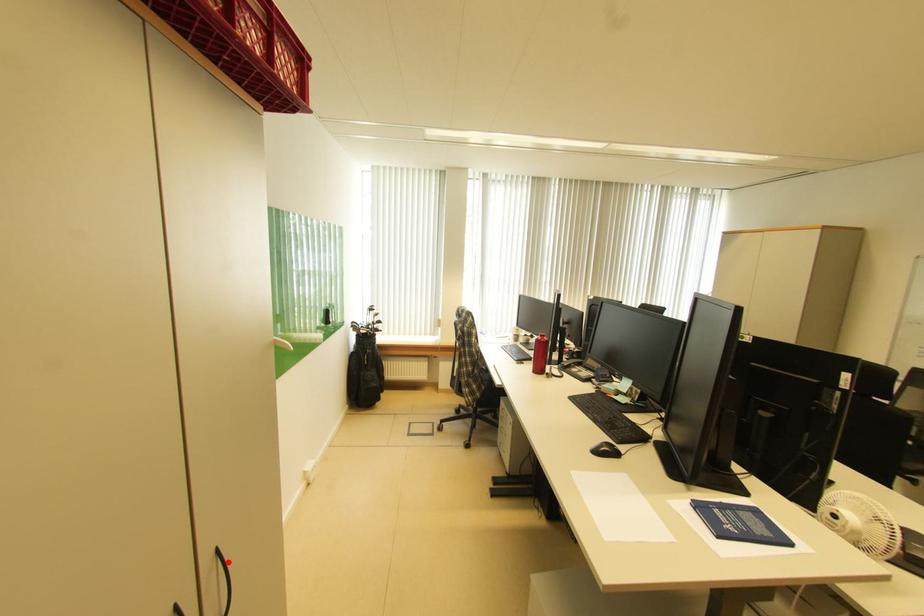
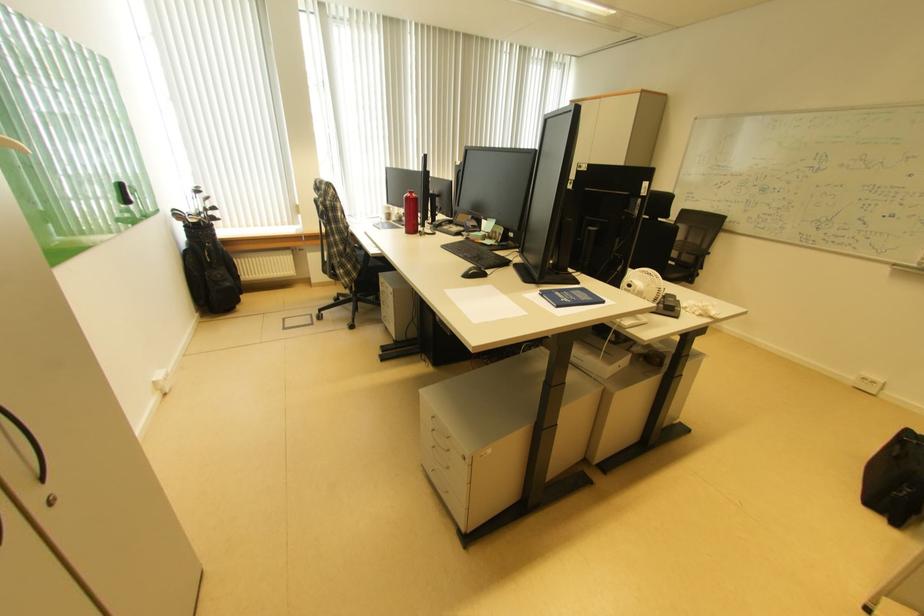
Where in the second image is the point corresponding to the highlighted location from the first image?

(6, 415)